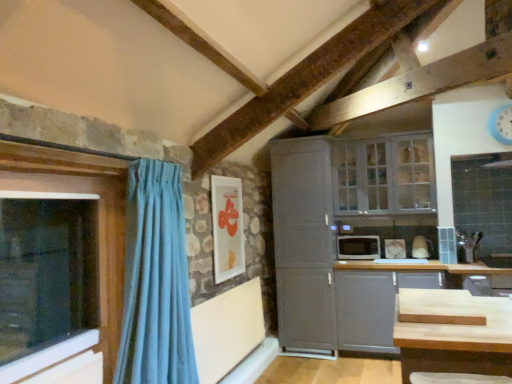
At what (x,y) coordinates should I click in order to perform the action: click on free space below white glossy picture frame at upper center (from a real-world perspective). Please return your answer as a coordinate pair (x, y). Image resolution: width=512 pixels, height=384 pixels. Looking at the image, I should click on (231, 285).